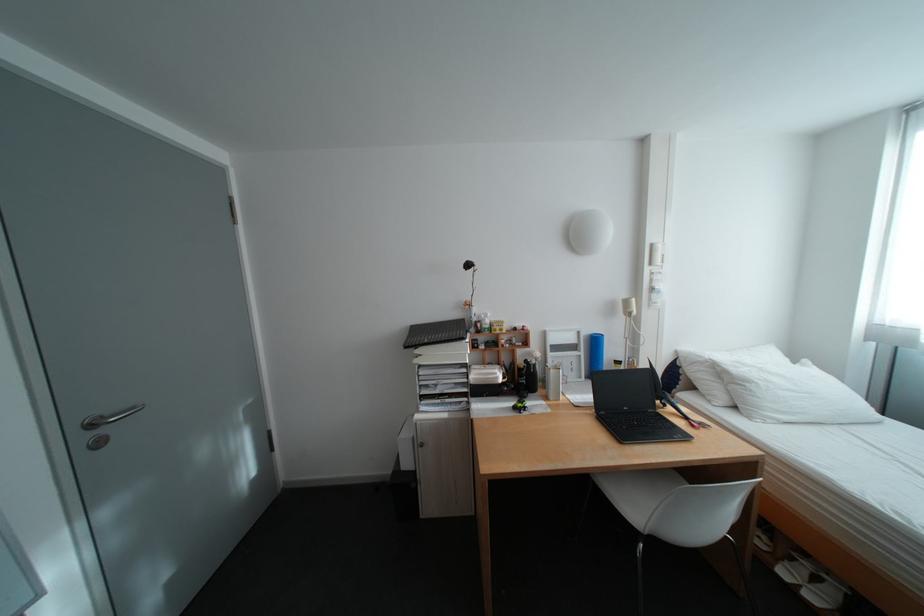
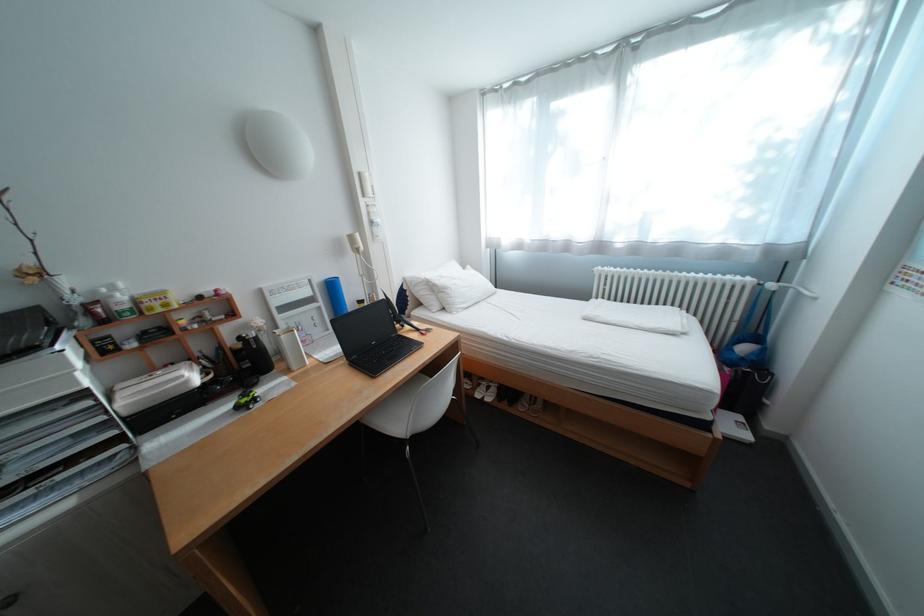
The first image is from the beginning of the video and the second image is from the end. How did the camera likely rotate when shooting the video?

The camera rotated toward right-down.